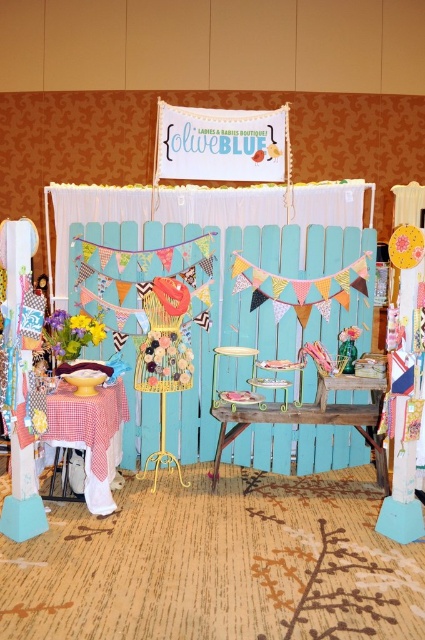
You are setting up a display for a boutique and need to place a tall decorative vase. Which table, the checkered fabric table at lower left or the rustic wood table at center, would be more suitable for the vase to ensure it stands out prominently?

The checkered fabric table at lower left has a greater height compared to the rustic wood table at center, making it more suitable for placing the tall decorative vase to ensure it stands out prominently.

You are standing in front of the boutique display. There are two points marked on the image at coordinates point (85, 458) and point (209, 474). Which point is nearer to your viewpoint?

Point (85, 458) is closer to the camera than point (209, 474), so the first point is nearer to your viewpoint.

Based on the photo, you are setting up a photo shoot at the boutique and need to position a large camera tripod. The tripod requires a space that is not obscured by other tables. Which table between the checkered fabric table at lower left and the rustic wood table at center should you avoid placing the tripod behind to ensure it stays visible in the photos?

You should avoid placing the tripod behind the checkered fabric table at lower left because it is in front of the rustic wood table at center, which means it would block the view of the rustic wood table and potentially obscure the tripod in the photos.